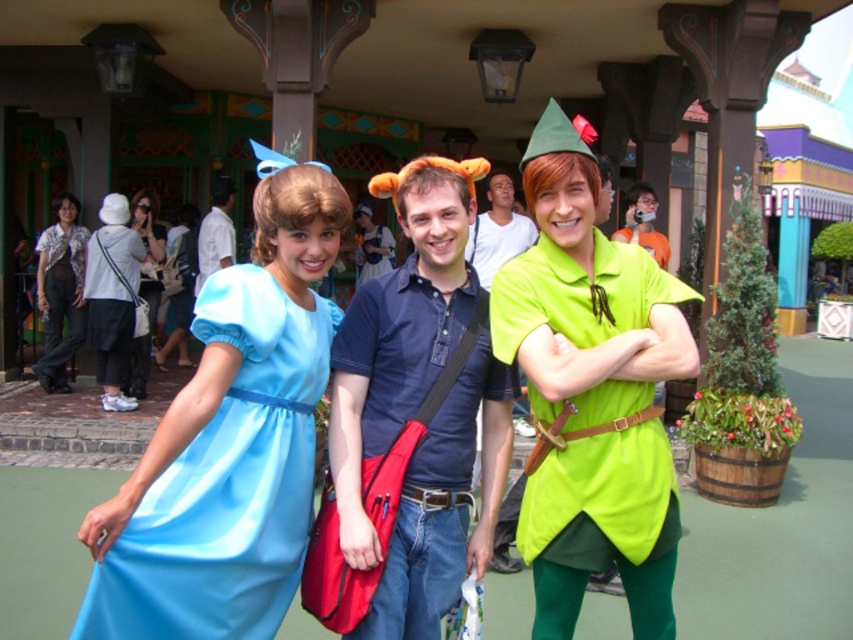
Question: Which object is farther from the camera taking this photo?

Choices:
 (A) light blue satin dress at center
 (B) blue cotton shirt at center
 (C) green matte shirt at center
 (D) dark blue cotton shirt at center

Answer: (B)

Question: Is green matte shirt at center closer to camera compared to dark blue cotton shirt at center?

Choices:
 (A) yes
 (B) no

Answer: (A)

Question: Among these points, which one is nearest to the camera?

Choices:
 (A) (518, 408)
 (B) (524, 172)

Answer: (B)

Question: Estimate the real-world distances between objects in this image. Which object is farther from the dark gray pants at left?

Choices:
 (A) matte white dress at left
 (B) matte blue shirt at center

Answer: (B)

Question: Is green matte shirt at center positioned before dark gray pants at left?

Choices:
 (A) yes
 (B) no

Answer: (A)

Question: Is dark blue cotton shirt at center thinner than matte blue shirt at center?

Choices:
 (A) yes
 (B) no

Answer: (B)